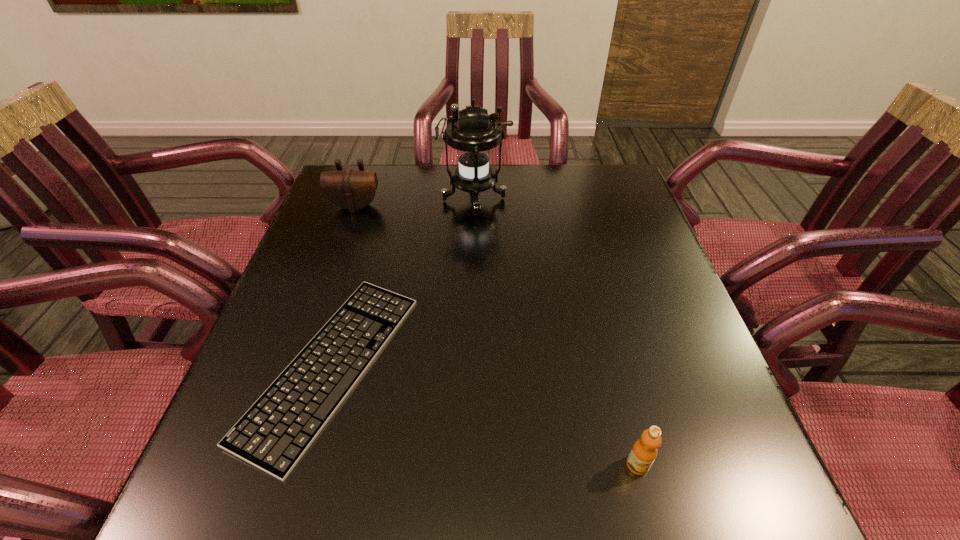
This screenshot has width=960, height=540. I want to click on blank space at the near left corner, so click(x=278, y=492).

In the image, there is a desktop. At what (x,y) coordinates should I click in order to perform the action: click on free space at the far right corner. Please return your answer as a coordinate pair (x, y). The image size is (960, 540). Looking at the image, I should click on (630, 184).

Locate an element on the screen. The image size is (960, 540). free space at the near right corner of the desktop is located at coordinates (663, 487).

Where is `free area in between the pouch and the computer keyboard`? The width and height of the screenshot is (960, 540). free area in between the pouch and the computer keyboard is located at coordinates (344, 286).

Find the location of a particular element. free space between the pouch and the second object from right to left is located at coordinates (415, 203).

At what (x,y) coordinates should I click in order to perform the action: click on free spot between the pouch and the computer keyboard. Please return your answer as a coordinate pair (x, y). The image size is (960, 540). Looking at the image, I should click on point(344,286).

The image size is (960, 540). Identify the location of empty location between the pouch and the rightmost object. (496, 335).

Find the location of a particular element. This screenshot has height=540, width=960. free space between the computer keyboard and the tallest object is located at coordinates (403, 282).

The height and width of the screenshot is (540, 960). I want to click on vacant area that lies between the computer keyboard and the third object from left to right, so pyautogui.click(x=403, y=282).

Identify the location of free point between the shortest object and the tallest object. This screenshot has width=960, height=540. (403, 282).